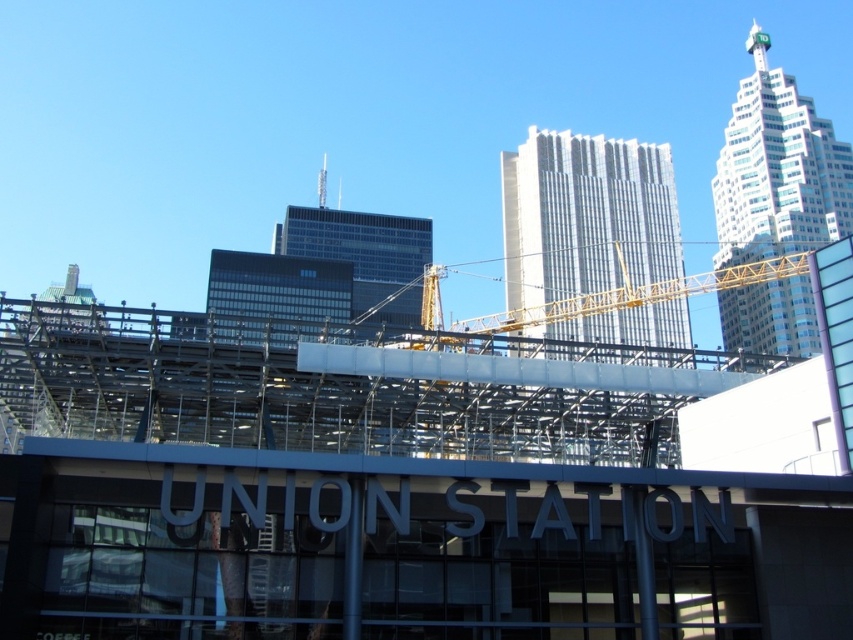
Looking at this image, is white glass skyscraper at upper right to the left of yellow metallic crane at center from the viewer's perspective?

Incorrect, white glass skyscraper at upper right is not on the left side of yellow metallic crane at center.

Does white glass skyscraper at upper right have a lesser width compared to yellow metallic crane at center?

Yes.

Is point (792, 214) positioned in front of point (693, 289)?

No, it is not.

Locate an element on the screen. white glass skyscraper at upper right is located at coordinates (776, 170).

Between silver glass skyscraper at center and yellow metallic crane at center, which one has less height?

yellow metallic crane at center is shorter.

Is point (634, 182) farther from viewer compared to point (432, 339)?

Yes, it is behind point (432, 339).

The height and width of the screenshot is (640, 853). Describe the element at coordinates (585, 216) in the screenshot. I see `silver glass skyscraper at center` at that location.

Where is `silver glass skyscraper at center`? silver glass skyscraper at center is located at coordinates (585, 216).

Which of these two, silver glass skyscraper at center or glassy black skyscraper at center, stands shorter?

With less height is silver glass skyscraper at center.

Does point (581, 177) come farther from viewer compared to point (306, 212)?

No, it is not.

Which is in front, point (521, 186) or point (329, 230)?

Positioned in front is point (521, 186).

Locate an element on the screen. The width and height of the screenshot is (853, 640). silver glass skyscraper at center is located at coordinates (585, 216).